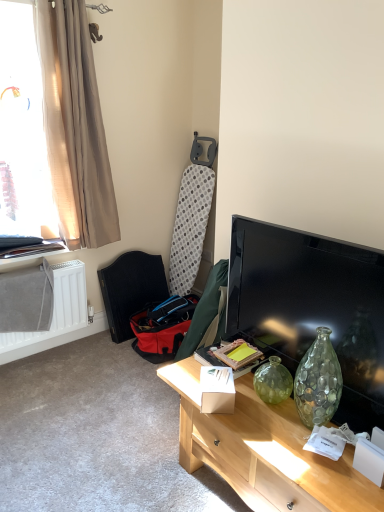
You are a GUI agent. You are given a task and a screenshot of the screen. Output one action in this format:
    pyautogui.click(x=<x>, y=<y>)
    Task: Click on the matte black tv at right
    The width and height of the screenshot is (384, 512).
    Given the screenshot: What is the action you would take?
    pyautogui.click(x=312, y=306)

You are a GUI agent. You are given a task and a screenshot of the screen. Output one action in this format:
    pyautogui.click(x=<x>, y=<y>)
    Task: Click on the translucent beige curtain at upper left
    This screenshot has height=512, width=384.
    Given the screenshot: What is the action you would take?
    pyautogui.click(x=23, y=125)

Measure the distance between dark brown leather armchair at lower left and camera.

They are 9.42 feet apart.

The width and height of the screenshot is (384, 512). I want to click on light wood desk at center, so click(x=264, y=451).

Image resolution: width=384 pixels, height=512 pixels. In the image, there is a white cardboard box at center. Find the location of `window above it (from the image's perspective)`. window above it (from the image's perspective) is located at coordinates (23, 125).

Considering the sizes of white cardboard box at center and translucent beige curtain at upper left in the image, is white cardboard box at center taller or shorter than translucent beige curtain at upper left?

Considering their sizes, white cardboard box at center has less height than translucent beige curtain at upper left.

Is white cardboard box at center closer to camera compared to translucent beige curtain at upper left?

Yes, white cardboard box at center is in front of translucent beige curtain at upper left.

Who is bigger, white cardboard box at center or translucent beige curtain at upper left?

Bigger between the two is translucent beige curtain at upper left.

From the image's perspective, between white matte radiator at lower left and white cardboard box at center, who is located below?

white cardboard box at center appears lower in the image.

Would you say white matte radiator at lower left is outside white cardboard box at center?

Yes, white matte radiator at lower left is outside of white cardboard box at center.

Can you tell me how much white matte radiator at lower left and white cardboard box at center differ in facing direction?

There is a 127-degree angle between the facing directions of white matte radiator at lower left and white cardboard box at center.

Which of these two, white matte radiator at lower left or white cardboard box at center, is smaller?

With smaller size is white cardboard box at center.

Could you tell me if white matte radiator at lower left is turned towards dark brown leather armchair at lower left?

No, white matte radiator at lower left is not oriented towards dark brown leather armchair at lower left.

Considering the points (68, 313) and (128, 256), which point is behind, point (68, 313) or point (128, 256)?

Point (128, 256)

Can you confirm if white matte radiator at lower left is taller than dark brown leather armchair at lower left?

In fact, white matte radiator at lower left may be shorter than dark brown leather armchair at lower left.

In terms of size, does white matte radiator at lower left appear bigger or smaller than dark brown leather armchair at lower left?

white matte radiator at lower left is smaller than dark brown leather armchair at lower left.

Consider the image. Based on their positions, is matte black tv at right located to the left or right of white matte radiator at lower left?

matte black tv at right is positioned on white matte radiator at lower left's right side.

From a real-world perspective, is matte black tv at right located higher than white matte radiator at lower left?

Correct, in the physical world, matte black tv at right is higher than white matte radiator at lower left.

Is matte black tv at right in front of or behind white matte radiator at lower left in the image?

In the image, matte black tv at right appears in front of white matte radiator at lower left.

Considering the sizes of objects dark brown leather armchair at lower left and white cardboard box at center in the image provided, who is thinner, dark brown leather armchair at lower left or white cardboard box at center?

With smaller width is white cardboard box at center.

Identify the location of box in front of the dark brown leather armchair at lower left. Image resolution: width=384 pixels, height=512 pixels. (217, 390).

Between dark brown leather armchair at lower left and white cardboard box at center, which one has larger size?

dark brown leather armchair at lower left is bigger.

Who is shorter, dark brown leather armchair at lower left or white cardboard box at center?

With less height is white cardboard box at center.

Which is farther, [69,341] or [23,60]?

The point [69,341] is farther.

In the scene shown: Considering the relative positions of white matte radiator at lower left and translucent beige curtain at upper left in the image provided, is white matte radiator at lower left to the left of translucent beige curtain at upper left from the viewer's perspective?

Incorrect, white matte radiator at lower left is not on the left side of translucent beige curtain at upper left.

Is white matte radiator at lower left oriented away from translucent beige curtain at upper left?

No, white matte radiator at lower left is not facing the opposite direction of translucent beige curtain at upper left.

From a real-world perspective, is white matte radiator at lower left physically located above or below translucent beige curtain at upper left?

In terms of real-world spatial position, white matte radiator at lower left is below translucent beige curtain at upper left.

Where is `television above the white matte radiator at lower left (from a real-world perspective)`? The height and width of the screenshot is (512, 384). television above the white matte radiator at lower left (from a real-world perspective) is located at coordinates (312, 306).

Is point (67, 282) positioned in front of point (303, 288)?

No, (67, 282) is further to viewer.

Is white matte radiator at lower left in front of or behind matte black tv at right in the image?

white matte radiator at lower left is positioned farther from the viewer than matte black tv at right.

At what (x,y) coordinates should I click in order to perform the action: click on box below the translucent beige curtain at upper left (from a real-world perspective). Please return your answer as a coordinate pair (x, y). The width and height of the screenshot is (384, 512). Looking at the image, I should click on (217, 390).

In order to click on box positioned vertically above the white matte radiator at lower left (from a real-world perspective) in this screenshot , I will do `click(217, 390)`.

Looking at the image, which one is located closer to translucent beige curtain at upper left, white matte radiator at lower left or white cardboard box at center?

white matte radiator at lower left.

From the image, which object appears to be farther from dark brown leather armchair at lower left, white cardboard box at center or light wood desk at center?

white cardboard box at center is further to dark brown leather armchair at lower left.

Looking at the image, which one is located closer to white matte radiator at lower left, white cardboard box at center or light wood desk at center?

white cardboard box at center is positioned closer to the anchor white matte radiator at lower left.

From the image, which object appears to be farther from matte black tv at right, white cardboard box at center or translucent beige curtain at upper left?

translucent beige curtain at upper left.

Considering their positions, is white cardboard box at center positioned closer to light wood desk at center than matte black tv at right?

The object closer to light wood desk at center is white cardboard box at center.

From the image, which object appears to be nearer to light wood desk at center, beige fabric curtain at left or dark brown leather armchair at lower left?

dark brown leather armchair at lower left lies closer to light wood desk at center than the other object.

Estimate the real-world distances between objects in this image. Which object is further from beige fabric curtain at left, dark brown leather armchair at lower left or matte black tv at right?

Among the two, matte black tv at right is located further to beige fabric curtain at left.

When comparing their distances from light wood desk at center, does matte black tv at right or white matte radiator at lower left seem further?

Among the two, white matte radiator at lower left is located further to light wood desk at center.

Find the location of `armchair between translucent beige curtain at upper left and white cardboard box at center in the vertical direction`. armchair between translucent beige curtain at upper left and white cardboard box at center in the vertical direction is located at coordinates (131, 289).

Image resolution: width=384 pixels, height=512 pixels. Find the location of `radiator between translucent beige curtain at upper left and white cardboard box at center in the vertical direction`. radiator between translucent beige curtain at upper left and white cardboard box at center in the vertical direction is located at coordinates [53, 315].

The height and width of the screenshot is (512, 384). In order to click on desk situated between white matte radiator at lower left and matte black tv at right from left to right in this screenshot , I will do `click(264, 451)`.

You are a GUI agent. You are given a task and a screenshot of the screen. Output one action in this format:
    pyautogui.click(x=<x>, y=<y>)
    Task: Click on the armchair located between translucent beige curtain at upper left and matte black tv at right in the left-right direction
    Image resolution: width=384 pixels, height=512 pixels.
    Given the screenshot: What is the action you would take?
    pyautogui.click(x=131, y=289)